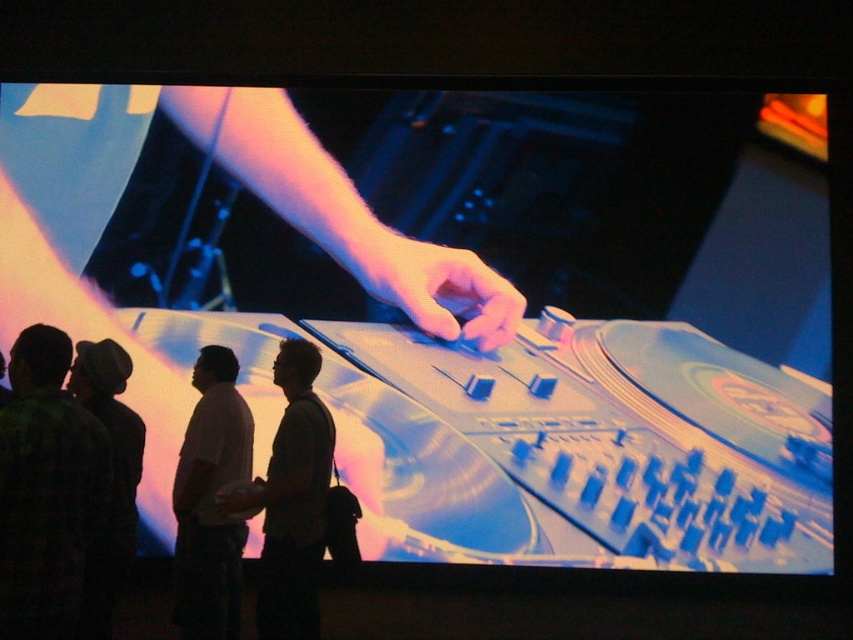
You are a photographer at the event and want to capture a photo of the white matte shirt at lower left and the pink matte hand at center. Which object should you zoom in on to focus on the thinner one?

The white matte shirt at lower left is thinner than the pink matte hand at center, so you should zoom in on the white matte shirt at lower left to focus on the thinner one.

You are at a concert and want to take a photo of the DJ setup. There are two people in front of you wearing a green plaid shirt at lower left and a white matte shirt at lower left. Which shirt should you move to the right to get a better view?

You should move the green plaid shirt at lower left to the right since it is to the left of the white matte shirt at lower left, so moving it would create space.